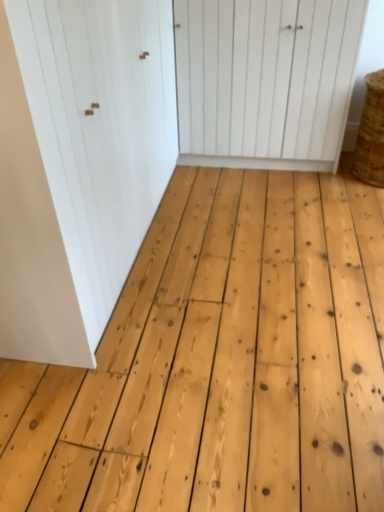
Question: Considering the relative sizes of white wood door at center, which is the first door from right to left, and white matte door at upper left, arranged as the 2th door when viewed from the right, in the image provided, is white wood door at center, which is the first door from right to left, wider than white matte door at upper left, arranged as the 2th door when viewed from the right,?

Choices:
 (A) yes
 (B) no

Answer: (B)

Question: Is white wood door at center, which is the first door from right to left, positioned behind white matte door at upper left, arranged as the 2th door when viewed from the right?

Choices:
 (A) yes
 (B) no

Answer: (A)

Question: Is white wood door at center, which is the first door from right to left, at the left side of white matte door at upper left, arranged as the 2th door when viewed from the right?

Choices:
 (A) no
 (B) yes

Answer: (A)

Question: Can you see white wood door at center, which is counted as the second door, starting from the left, touching white matte door at upper left, the 1th door in the left-to-right sequence?

Choices:
 (A) no
 (B) yes

Answer: (A)

Question: Is white wood door at center, which is counted as the second door, starting from the left, surrounding white matte door at upper left, the 1th door in the left-to-right sequence?

Choices:
 (A) no
 (B) yes

Answer: (A)

Question: Is braided straw basket at right bigger or smaller than white matte door at upper left, arranged as the 2th door when viewed from the right?

Choices:
 (A) small
 (B) big

Answer: (A)

Question: Do you think braided straw basket at right is within white matte door at upper left, arranged as the 2th door when viewed from the right, or outside of it?

Choices:
 (A) outside
 (B) inside

Answer: (A)

Question: Is braided straw basket at right in front of or behind white matte door at upper left, the 1th door in the left-to-right sequence, in the image?

Choices:
 (A) behind
 (B) front

Answer: (A)

Question: Considering the positions of braided straw basket at right and white matte door at upper left, the 1th door in the left-to-right sequence, in the image, is braided straw basket at right wider or thinner than white matte door at upper left, the 1th door in the left-to-right sequence,?

Choices:
 (A) wide
 (B) thin

Answer: (B)

Question: Is white matte door at upper left, the 1th door in the left-to-right sequence, in front of or behind white wood door at center, which is the first door from right to left, in the image?

Choices:
 (A) behind
 (B) front

Answer: (B)

Question: From a real-world perspective, relative to white wood door at center, which is counted as the second door, starting from the left, is white matte door at upper left, arranged as the 2th door when viewed from the right, vertically above or below?

Choices:
 (A) below
 (B) above

Answer: (B)

Question: Looking at the image, does white matte door at upper left, the 1th door in the left-to-right sequence, seem bigger or smaller compared to white wood door at center, which is the first door from right to left?

Choices:
 (A) small
 (B) big

Answer: (B)

Question: Would you say white matte door at upper left, arranged as the 2th door when viewed from the right, is to the left or to the right of white wood door at center, which is counted as the second door, starting from the left, in the picture?

Choices:
 (A) left
 (B) right

Answer: (A)

Question: Considering the positions of white wood door at center, which is counted as the second door, starting from the left, and braided straw basket at right in the image, is white wood door at center, which is counted as the second door, starting from the left, bigger or smaller than braided straw basket at right?

Choices:
 (A) small
 (B) big

Answer: (B)

Question: Is point (306, 37) closer or farther from the camera than point (379, 102)?

Choices:
 (A) closer
 (B) farther

Answer: (A)